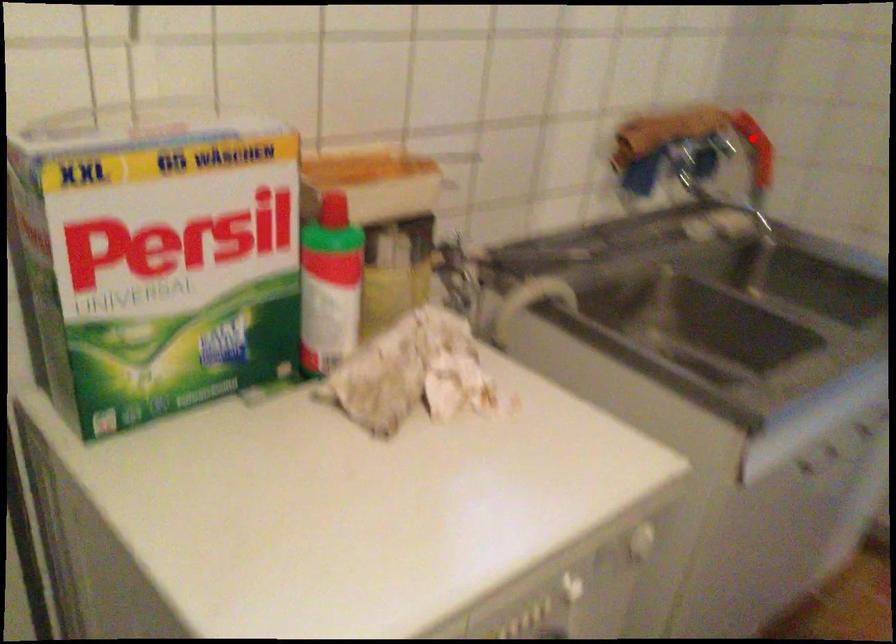
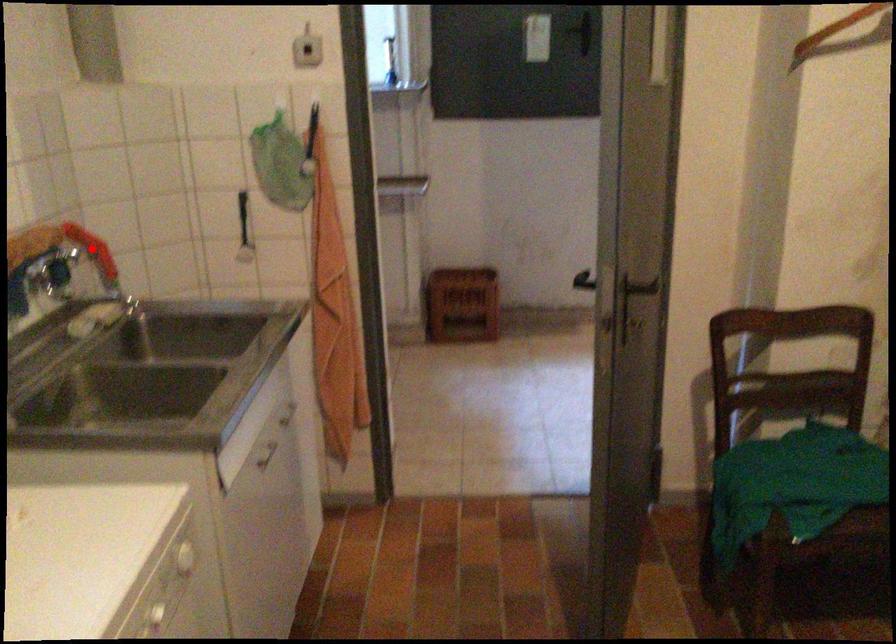
I am providing you with two images of the same scene from different viewpoints. A red point is marked on the first image and another point is marked on the second image. Do the highlighted points in image1 and image2 indicate the same real-world spot?

Yes